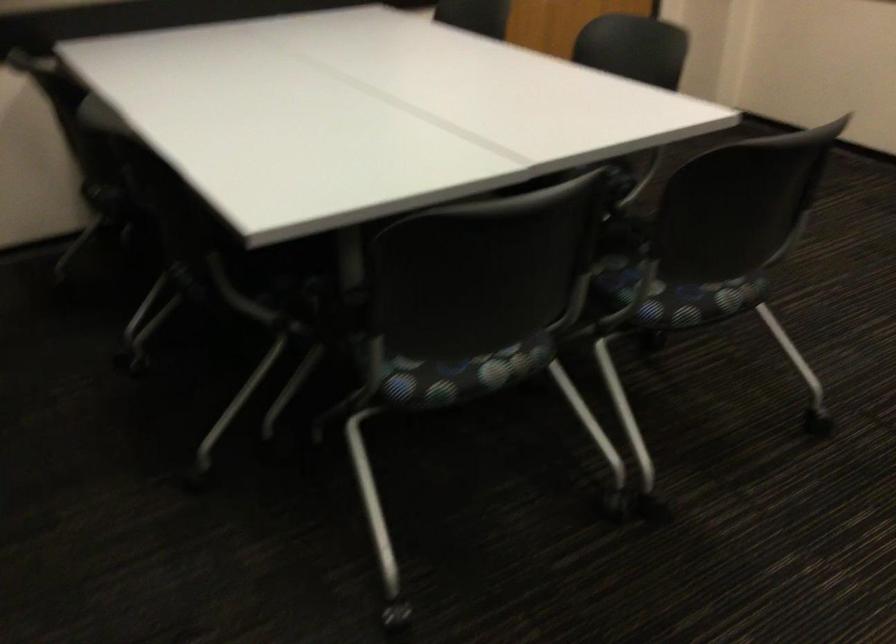
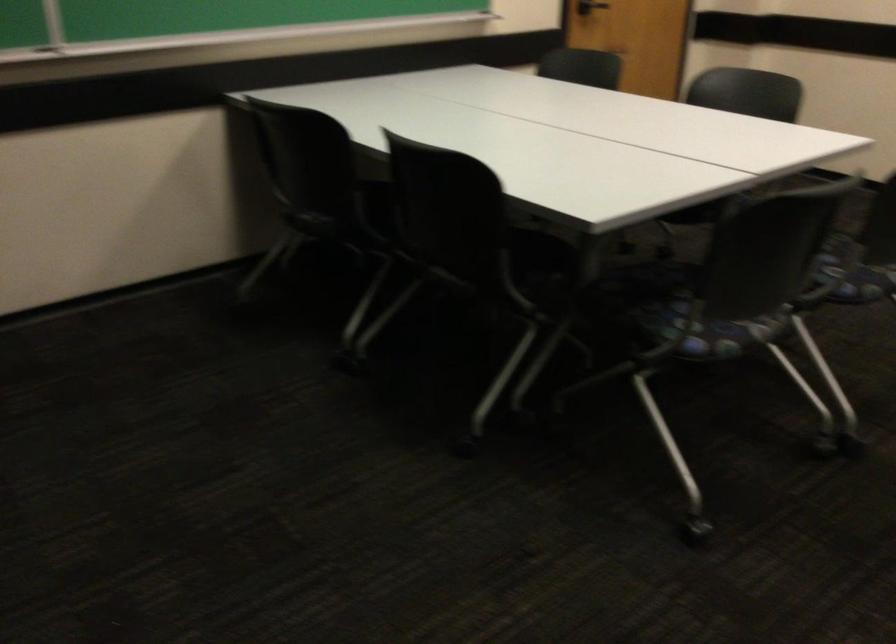
Where in the second image is the point corresponding to (444,366) from the first image?

(719, 333)